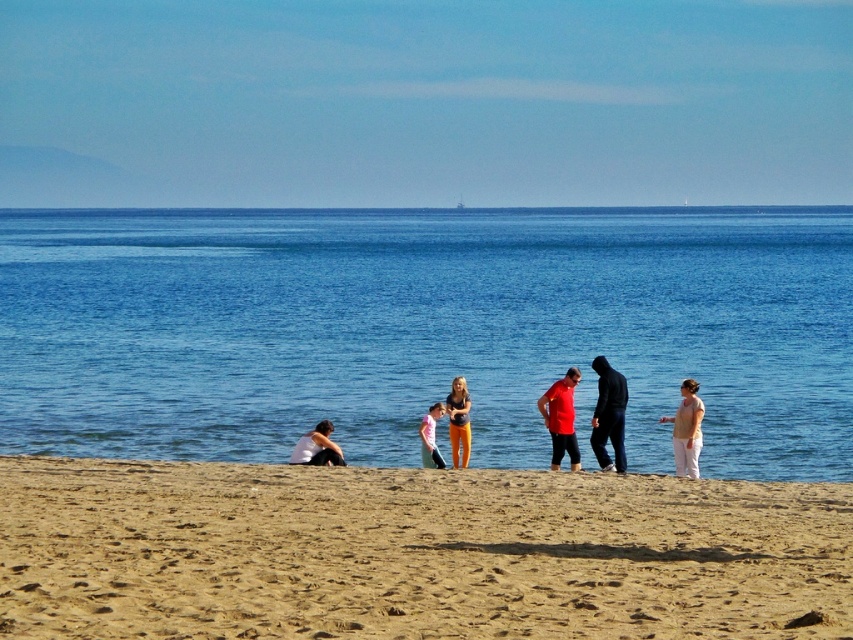
Question: Which of the following is the farthest from the observer?

Choices:
 (A) white fabric at lower left
 (B) orange pants at center
 (C) light beige cotton shirt at center

Answer: (B)

Question: Based on their relative distances, which object is nearer to the matte red shirt at center?

Choices:
 (A) dark blue wetsuit at center
 (B) white fabric at lower left
 (C) fine-grained sand at lower center
 (D) blue water at center

Answer: (A)

Question: Which point is closer to the camera taking this photo?

Choices:
 (A) (312, 456)
 (B) (572, 417)

Answer: (A)

Question: Can you confirm if matte red shirt at center is positioned below light beige cotton shirt at center?

Choices:
 (A) yes
 (B) no

Answer: (B)

Question: Is blue water at center thinner than light pink fabric dress at center?

Choices:
 (A) no
 (B) yes

Answer: (A)

Question: Can you confirm if fine-grained sand at lower center is positioned to the left of white fabric at lower left?

Choices:
 (A) no
 (B) yes

Answer: (A)